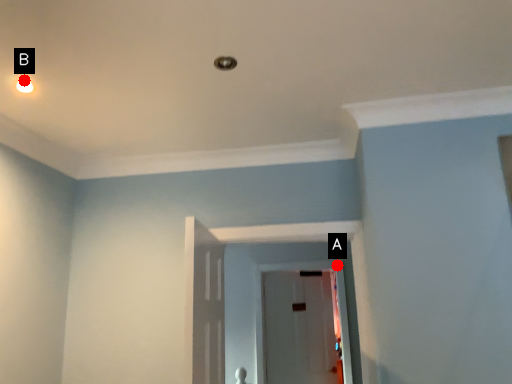
Question: Two points are circled on the image, labeled by A and B beside each circle. Which point is closer to the camera?

Choices:
 (A) A is closer
 (B) B is closer

Answer: (B)